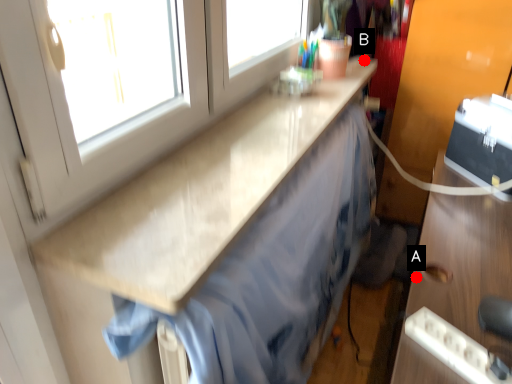
Question: Two points are circled on the image, labeled by A and B beside each circle. Which point is closer to the camera taking this photo?

Choices:
 (A) A is closer
 (B) B is closer

Answer: (A)